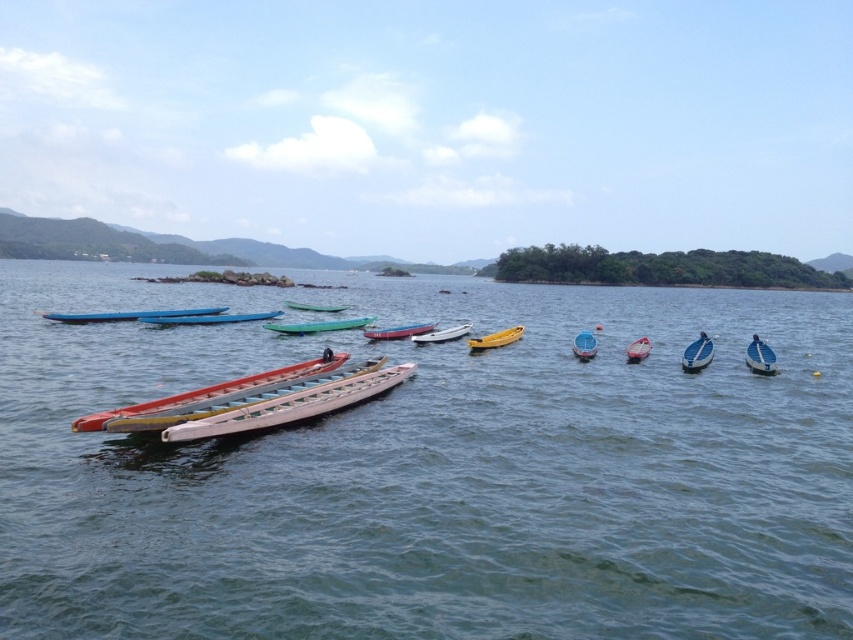
Who is taller, blue glossy kayak at center-right or yellow matte boat at center?

blue glossy kayak at center-right

Who is more forward, (705,364) or (467,339)?

Point (705,364) is more forward.

Find the location of a particular element. blue glossy kayak at center-right is located at coordinates (697, 353).

Which of these two, matte blue canoe at center or green plastic canoe at center, stands taller?

green plastic canoe at center is taller.

Who is more forward, (242, 316) or (334, 324)?

Positioned in front is point (334, 324).

Identify the location of matte blue canoe at center. The height and width of the screenshot is (640, 853). (209, 317).

Does matte blue canoe at left have a smaller size compared to white plastic canoe at center?

Actually, matte blue canoe at left might be larger than white plastic canoe at center.

Does matte blue canoe at left appear on the right side of white plastic canoe at center?

In fact, matte blue canoe at left is to the left of white plastic canoe at center.

I want to click on matte blue canoe at left, so click(x=131, y=314).

I want to click on matte blue canoe at left, so click(131, 314).